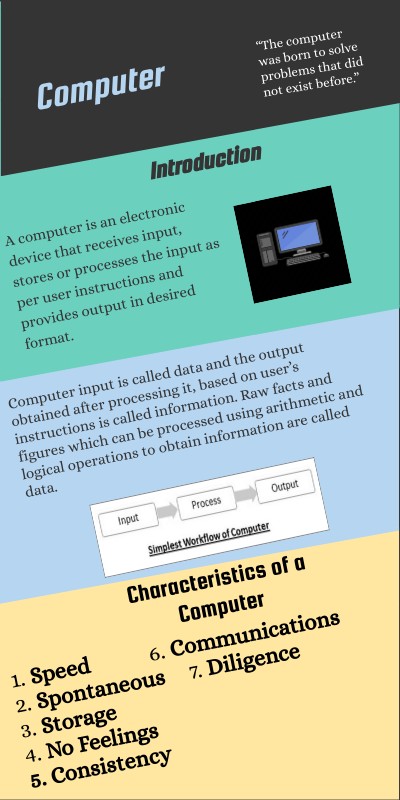
The height and width of the screenshot is (800, 400). Find the location of `keyboard`. keyboard is located at coordinates (301, 258).